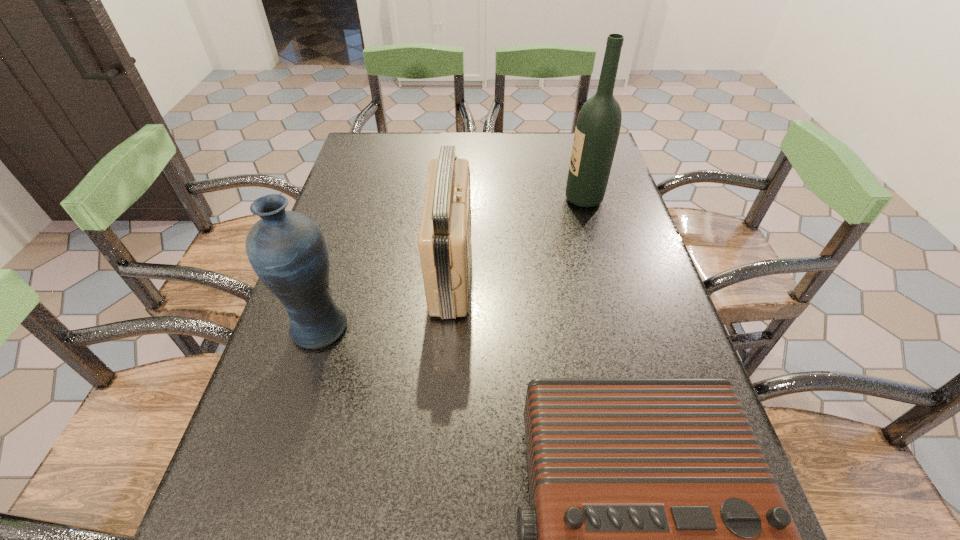
The height and width of the screenshot is (540, 960). I want to click on object present at the left edge, so click(287, 250).

The height and width of the screenshot is (540, 960). What are the coordinates of `object present at the right edge` in the screenshot? It's located at (597, 130).

This screenshot has width=960, height=540. I want to click on free location at the far edge, so click(x=532, y=137).

Identify the location of vacant space at the left edge of the desktop. This screenshot has height=540, width=960. (377, 183).

Identify the location of vacant space at the right edge. This screenshot has height=540, width=960. (591, 299).

The width and height of the screenshot is (960, 540). Identify the location of vacant space at the far left corner. (350, 157).

Find the location of a particular element. Image resolution: width=960 pixels, height=540 pixels. vacant space at the far right corner is located at coordinates (559, 165).

The width and height of the screenshot is (960, 540). I want to click on free point between the wine bottle and the third tallest object, so [x=517, y=236].

You are a GUI agent. You are given a task and a screenshot of the screen. Output one action in this format:
    pyautogui.click(x=<x>, y=<y>)
    Task: Click on the vacant point located between the second shortest object and the farthest object
    
    Given the screenshot: What is the action you would take?
    pyautogui.click(x=517, y=236)

Locate which object is the third closest to the second shortest object. Please provide its 2D coordinates. Your answer should be formatted as a tuple, i.e. [(x, y)], where the tuple contains the x and y coordinates of a point satisfying the conditions above.

[(597, 130)]